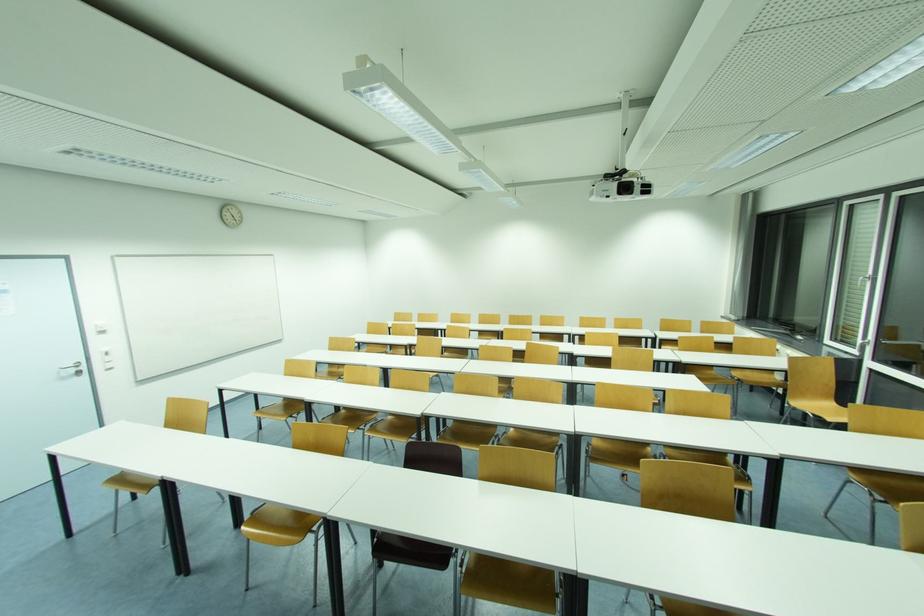
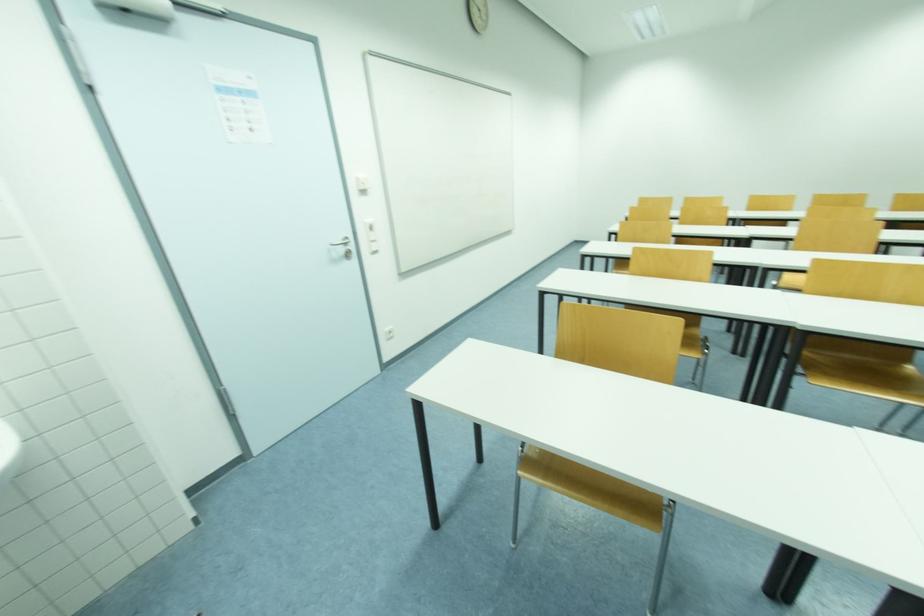
In a continuous first-person perspective shot, in which direction is the camera moving?

The cameraman walked toward left, forward.